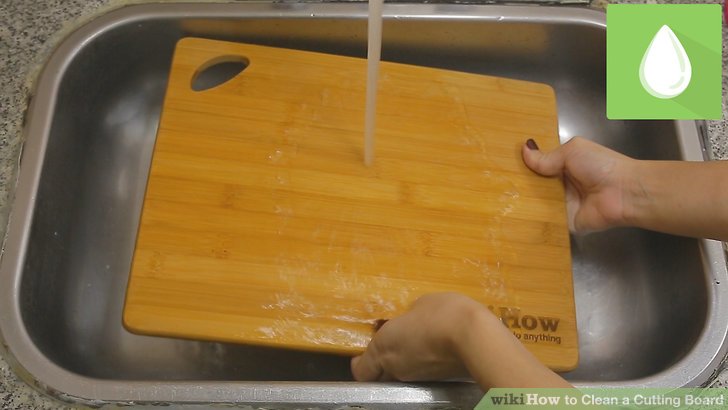
Find the location of a particular element. This screenshot has width=728, height=410. water hitting cutting board is located at coordinates (368, 236).